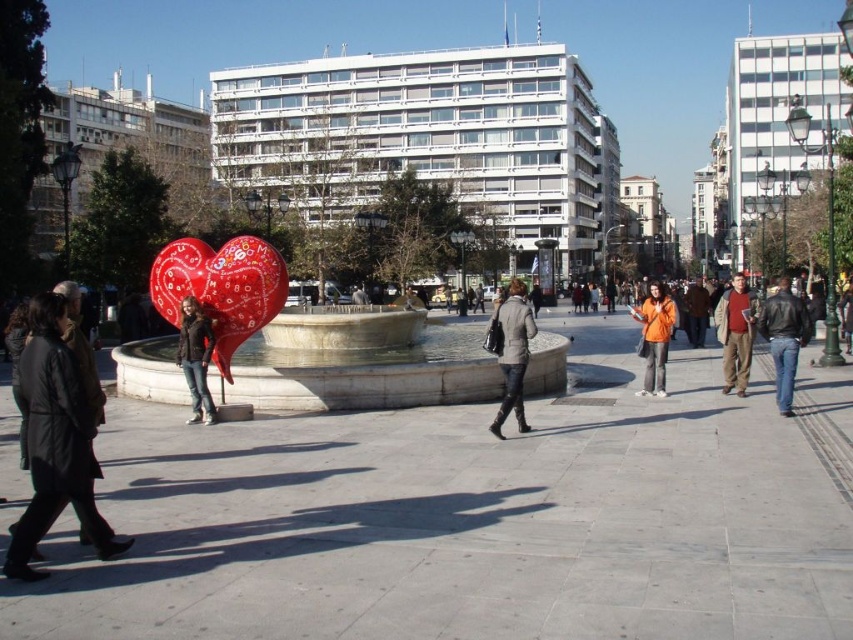
You are a delivery person trying to place a gray wool coat at center on the shiny metallic heart at center. Can you place the coat on the heart without moving the heart?

The shiny metallic heart at center is above gray wool coat at center, so the coat is already placed on the heart. Therefore, you don not need to move the heart to place the coat there.

You are standing in the urban square and want to find the white marble fountain at center. According to the coordinates provided, where should you look relative to the square?

The white marble fountain at center is located at coordinates approximately 0.544 on the x axis and 0.369 on the y axis, which places it near the center of the square.